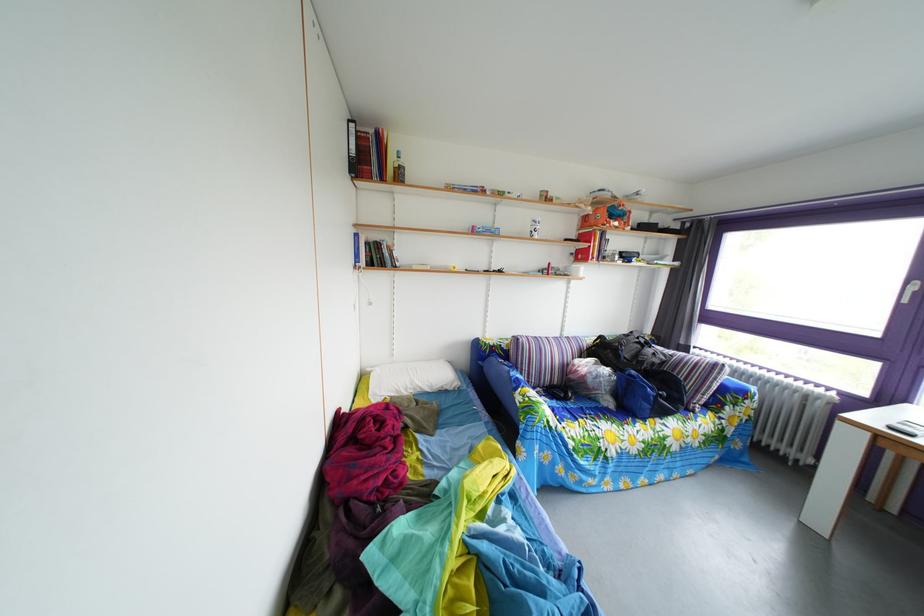
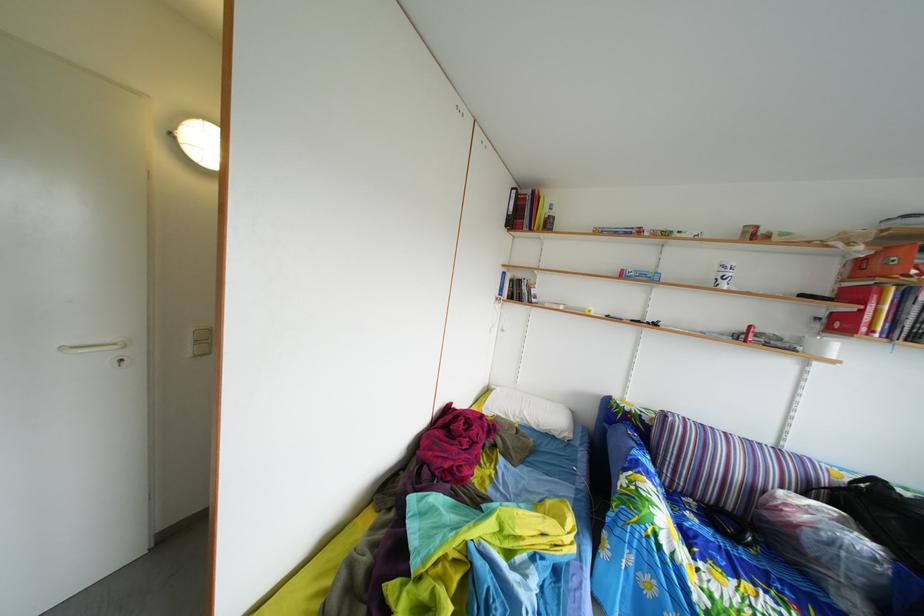
The point at (442, 395) is marked in the first image. Where is the corresponding point in the second image?

(549, 434)